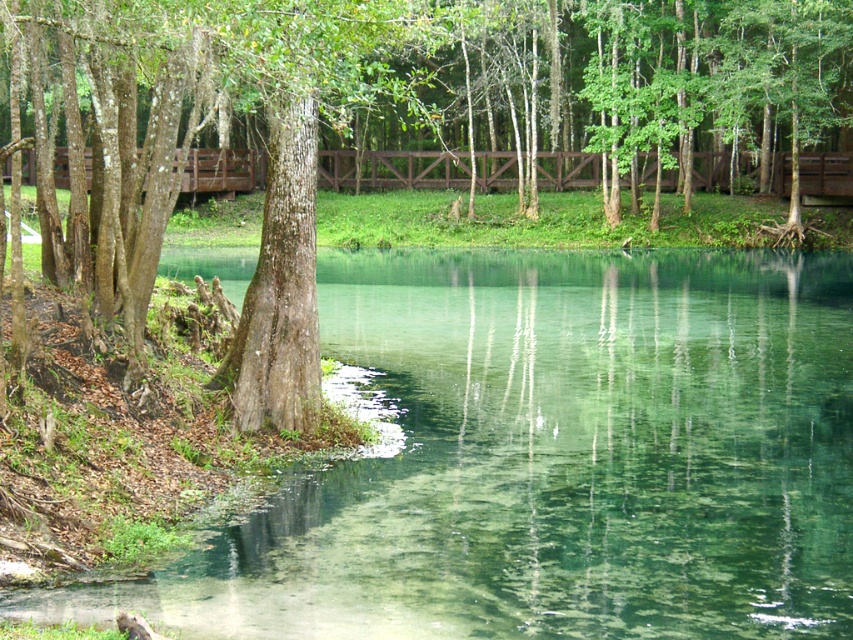
You are standing near the smooth bark tree at left and want to cross to the other side of the clear glassy water at center. Which direction should you walk to reach the water?

You should walk to the right of the smooth bark tree at left to reach the clear glassy water at center, as it is located to the right of the tree.

You are standing at the edge of the water and see the point marked at coordinates (550, 458). Based on the scene description, what type of surface would you expect to find at that location?

The point at coordinates (550, 458) indicates clear glassy water at center, so you would expect to find clear and smooth water surface there.